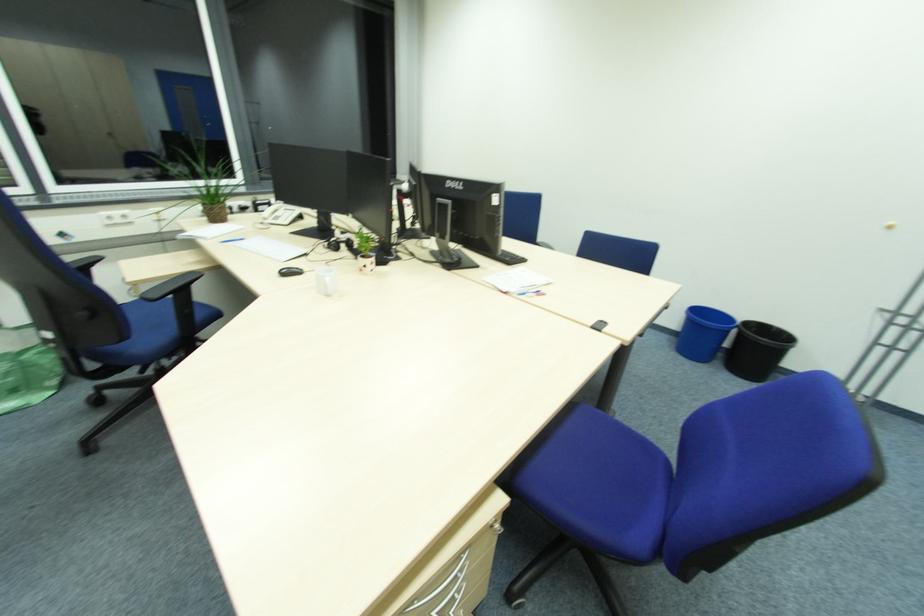
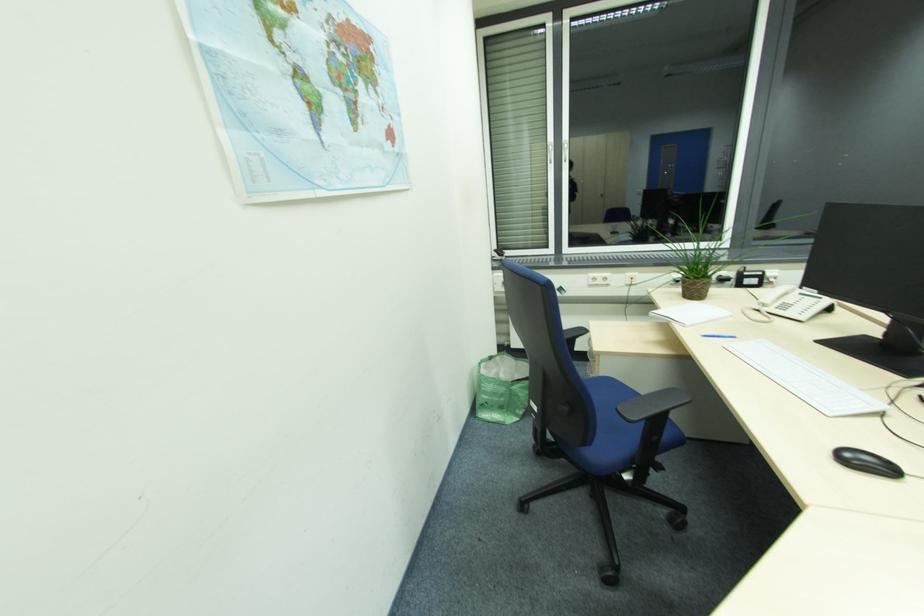
Question: Based on the continuous images, in which direction is the camera rotating? Reply with the corresponding letter.

Choices:
 (A) Left
 (B) Right
 (C) Up
 (D) Down

Answer: (A)